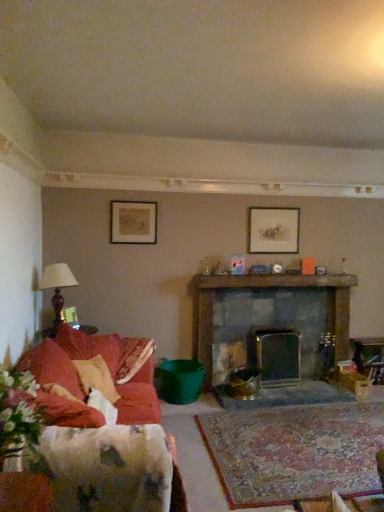
This screenshot has width=384, height=512. What do you see at coordinates (275, 355) in the screenshot?
I see `metallic silver fireplace at center, the first fireplace positioned from the right` at bounding box center [275, 355].

The height and width of the screenshot is (512, 384). I want to click on metallic silver fireplace at center, the first fireplace positioned from the right, so click(275, 355).

The image size is (384, 512). What do you see at coordinates (57, 286) in the screenshot?
I see `matte brown lamp at left` at bounding box center [57, 286].

This screenshot has height=512, width=384. Describe the element at coordinates (71, 357) in the screenshot. I see `velvet red couch at left` at that location.

What do you see at coordinates (270, 316) in the screenshot?
I see `dark gray stone fireplace at center, arranged as the 1th fireplace when viewed from the left` at bounding box center [270, 316].

Measure the distance between dark gray stone fireplace at center, which is counted as the second fireplace, starting from the right, and camera.

4.36 meters.

Measure the distance between velvet red couch at left and camera.

1.25 meters.

Describe the element at coordinates (81, 448) in the screenshot. I see `velvet red couch at left` at that location.

Image resolution: width=384 pixels, height=512 pixels. In order to click on metallic silver fireplace at center, the first fireplace positioned from the right in this screenshot , I will do `click(275, 355)`.

Can you confirm if dark gray stone fireplace at center, arranged as the 1th fireplace when viewed from the left, is thinner than metallic silver fireplace at center, positioned as the 2th fireplace in left-to-right order?

In fact, dark gray stone fireplace at center, arranged as the 1th fireplace when viewed from the left, might be wider than metallic silver fireplace at center, positioned as the 2th fireplace in left-to-right order.

Considering the positions of objects dark gray stone fireplace at center, arranged as the 1th fireplace when viewed from the left, and metallic silver fireplace at center, the first fireplace positioned from the right, in the image provided, who is more to the right, dark gray stone fireplace at center, arranged as the 1th fireplace when viewed from the left, or metallic silver fireplace at center, the first fireplace positioned from the right,?

Positioned to the right is metallic silver fireplace at center, the first fireplace positioned from the right.

Is dark gray stone fireplace at center, which is counted as the second fireplace, starting from the right, bigger than metallic silver fireplace at center, positioned as the 2th fireplace in left-to-right order?

Yes, dark gray stone fireplace at center, which is counted as the second fireplace, starting from the right, is bigger than metallic silver fireplace at center, positioned as the 2th fireplace in left-to-right order.

From a real-world perspective, is dark gray stone fireplace at center, arranged as the 1th fireplace when viewed from the left, physically located above or below metallic silver fireplace at center, positioned as the 2th fireplace in left-to-right order?

dark gray stone fireplace at center, arranged as the 1th fireplace when viewed from the left, is above metallic silver fireplace at center, positioned as the 2th fireplace in left-to-right order.

From the image's perspective, is matte silver picture frame at upper center, the 2th picture frame in the bottom-to-top sequence, located beneath matte black picture frame at upper left, marked as the first picture frame in a top-to-bottom arrangement?

Yes.

Is matte silver picture frame at upper center, which is the first picture frame from right to left, facing away from matte black picture frame at upper left, acting as the second picture frame starting from the left?

No, matte silver picture frame at upper center, which is the first picture frame from right to left, is not facing away from matte black picture frame at upper left, acting as the second picture frame starting from the left.

This screenshot has height=512, width=384. In order to click on picture frame that is the 1st one when counting downward from the matte black picture frame at upper left, which is counted as the 3th picture frame, starting from the bottom (from the image's perspective) in this screenshot , I will do `click(273, 230)`.

Is matte silver picture frame at upper center, acting as the third picture frame starting from the left, to the right of matte black picture frame at upper left, which ranks as the 2th picture frame in right-to-left order, from the viewer's perspective?

Yes.

In the scene shown: Is matte silver picture frame at upper center, the 2th picture frame in the bottom-to-top sequence, situated inside matte gold picture frame at left, the first picture frame when ordered from bottom to top, or outside?

matte silver picture frame at upper center, the 2th picture frame in the bottom-to-top sequence, lies outside matte gold picture frame at left, the first picture frame when ordered from bottom to top.

Which object is further away from the camera, matte silver picture frame at upper center, which is the first picture frame in back-to-front order, or matte gold picture frame at left, which is counted as the third picture frame, starting from the top?

matte silver picture frame at upper center, which is the first picture frame in back-to-front order, is more distant.

Are matte silver picture frame at upper center, acting as the third picture frame starting from the left, and matte gold picture frame at left, arranged as the first picture frame when viewed from the front, far apart?

Yes, matte silver picture frame at upper center, acting as the third picture frame starting from the left, is far from matte gold picture frame at left, arranged as the first picture frame when viewed from the front.

Between matte gold picture frame at left, which is counted as the third picture frame, starting from the top, and matte silver picture frame at upper center, acting as the third picture frame starting from the left, which one appears on the left side from the viewer's perspective?

matte gold picture frame at left, which is counted as the third picture frame, starting from the top.

Which point is more forward, (70,315) or (280,228)?

The point (70,315) is closer.

Is matte gold picture frame at left, the first picture frame when ordered from bottom to top, taller than matte silver picture frame at upper center, acting as the third picture frame starting from the left?

No.

From the picture: Which object is closer to the camera taking this photo, matte gold picture frame at left, arranged as the first picture frame when viewed from the front, or matte silver picture frame at upper center, positioned as the 2th picture frame in top-to-bottom order?

Positioned in front is matte gold picture frame at left, arranged as the first picture frame when viewed from the front.

In the scene shown: Would you say matte brown lamp at left contains metallic silver fireplace at center, the first fireplace positioned from the right?

Definitely not — metallic silver fireplace at center, the first fireplace positioned from the right, is not inside matte brown lamp at left.

From the image's perspective, is matte brown lamp at left beneath metallic silver fireplace at center, positioned as the 2th fireplace in left-to-right order?

Incorrect, from the image's perspective, matte brown lamp at left is higher than metallic silver fireplace at center, positioned as the 2th fireplace in left-to-right order.

Between matte brown lamp at left and metallic silver fireplace at center, positioned as the 2th fireplace in left-to-right order, which one appears on the right side from the viewer's perspective?

metallic silver fireplace at center, positioned as the 2th fireplace in left-to-right order, is more to the right.

Is matte black picture frame at upper left, which ranks as the 2th picture frame in right-to-left order, positioned beyond the bounds of matte silver picture frame at upper center, which is the first picture frame from right to left?

matte black picture frame at upper left, which ranks as the 2th picture frame in right-to-left order, is positioned outside matte silver picture frame at upper center, which is the first picture frame from right to left.

Which is more to the right, matte black picture frame at upper left, acting as the second picture frame starting from the left, or matte silver picture frame at upper center, which ranks as the third picture frame in front-to-back order?

Positioned to the right is matte silver picture frame at upper center, which ranks as the third picture frame in front-to-back order.

Which is behind, matte black picture frame at upper left, acting as the second picture frame starting from the left, or matte silver picture frame at upper center, the 2th picture frame in the bottom-to-top sequence?

matte silver picture frame at upper center, the 2th picture frame in the bottom-to-top sequence, is more distant.

What's the angular difference between matte black picture frame at upper left, acting as the second picture frame starting from the left, and matte silver picture frame at upper center, positioned as the 2th picture frame in top-to-bottom order,'s facing directions?

matte black picture frame at upper left, acting as the second picture frame starting from the left, and matte silver picture frame at upper center, positioned as the 2th picture frame in top-to-bottom order, are facing 0.00916 degrees away from each other.

Considering the sizes of objects velvet red couch at left and velvet red couch at left in the image provided, who is thinner, velvet red couch at left or velvet red couch at left?

With smaller width is velvet red couch at left.

Considering the positions of point (87, 415) and point (82, 349), is point (87, 415) closer or farther from the camera than point (82, 349)?

Clearly, point (87, 415) is closer to the camera than point (82, 349).

At what (x,y) coordinates should I click in order to perform the action: click on couch above the velvet red couch at left (from the image's perspective). Please return your answer as a coordinate pair (x, y). The height and width of the screenshot is (512, 384). Looking at the image, I should click on (71, 357).

I want to click on fireplace on the right side of dark gray stone fireplace at center, arranged as the 1th fireplace when viewed from the left, so [x=275, y=355].

Locate an element on the screen. The height and width of the screenshot is (512, 384). picture frame that is the 1st object located in front of the matte silver picture frame at upper center, the 2th picture frame in the bottom-to-top sequence is located at coordinates (133, 222).

Which object lies further to the anchor point matte silver picture frame at upper center, which ranks as the third picture frame in front-to-back order, velvet red couch at left or metallic silver fireplace at center, positioned as the 2th fireplace in left-to-right order?

Among the two, velvet red couch at left is located further to matte silver picture frame at upper center, which ranks as the third picture frame in front-to-back order.

In the scene shown: Which object lies nearer to the anchor point dark gray stone fireplace at center, arranged as the 1th fireplace when viewed from the left, matte brown lamp at left or velvet red couch at left?

velvet red couch at left is closer to dark gray stone fireplace at center, arranged as the 1th fireplace when viewed from the left.

Which object lies nearer to the anchor point matte black picture frame at upper left, acting as the 2th picture frame starting from the front, matte silver picture frame at upper center, the 2th picture frame in the bottom-to-top sequence, or metallic silver fireplace at center, the first fireplace positioned from the right?

matte silver picture frame at upper center, the 2th picture frame in the bottom-to-top sequence.

Estimate the real-world distances between objects in this image. Which object is closer to velvet red couch at left, metallic silver fireplace at center, the first fireplace positioned from the right, or matte silver picture frame at upper center, positioned as the 2th picture frame in top-to-bottom order?

metallic silver fireplace at center, the first fireplace positioned from the right.

From the image, which object appears to be nearer to dark gray stone fireplace at center, which is counted as the second fireplace, starting from the right, metallic silver fireplace at center, positioned as the 2th fireplace in left-to-right order, or matte brown lamp at left?

Based on the image, metallic silver fireplace at center, positioned as the 2th fireplace in left-to-right order, appears to be nearer to dark gray stone fireplace at center, which is counted as the second fireplace, starting from the right.

From the image, which object appears to be nearer to dark gray stone fireplace at center, which is counted as the second fireplace, starting from the right, matte black picture frame at upper left, acting as the second picture frame starting from the left, or matte gold picture frame at left, which appears as the third picture frame when viewed from the back?

matte black picture frame at upper left, acting as the second picture frame starting from the left, is closer to dark gray stone fireplace at center, which is counted as the second fireplace, starting from the right.

When comparing their distances from matte brown lamp at left, does matte silver picture frame at upper center, which ranks as the third picture frame in front-to-back order, or matte black picture frame at upper left, acting as the second picture frame starting from the left, seem further?

matte silver picture frame at upper center, which ranks as the third picture frame in front-to-back order, lies further to matte brown lamp at left than the other object.

When comparing their distances from matte gold picture frame at left, marked as the first picture frame in a left-to-right arrangement, does dark gray stone fireplace at center, which is counted as the second fireplace, starting from the right, or velvet red couch at left seem closer?

velvet red couch at left lies closer to matte gold picture frame at left, marked as the first picture frame in a left-to-right arrangement, than the other object.

Find the location of a particular element. fireplace situated between matte brown lamp at left and matte silver picture frame at upper center, the 2th picture frame in the bottom-to-top sequence, from left to right is located at coordinates (270, 316).

The height and width of the screenshot is (512, 384). I want to click on lamp between velvet red couch at left and metallic silver fireplace at center, the first fireplace positioned from the right, in the front-back direction, so pos(57,286).

Locate an element on the screen. couch between velvet red couch at left and metallic silver fireplace at center, positioned as the 2th fireplace in left-to-right order, along the z-axis is located at coordinates (71, 357).

Where is `fireplace between velvet red couch at left and matte silver picture frame at upper center, positioned as the 2th picture frame in top-to-bottom order, from left to right`? Image resolution: width=384 pixels, height=512 pixels. fireplace between velvet red couch at left and matte silver picture frame at upper center, positioned as the 2th picture frame in top-to-bottom order, from left to right is located at coordinates click(270, 316).